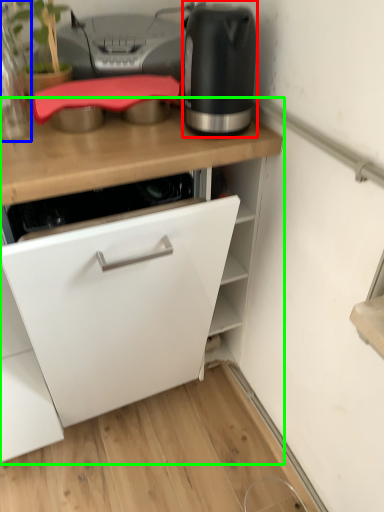
Question: Considering the real-world distances, which object is farthest from home appliance (highlighted by a red box)? kitchen appliance (highlighted by a blue box) or cabinetry (highlighted by a green box)?

Choices:
 (A) kitchen appliance
 (B) cabinetry

Answer: (A)